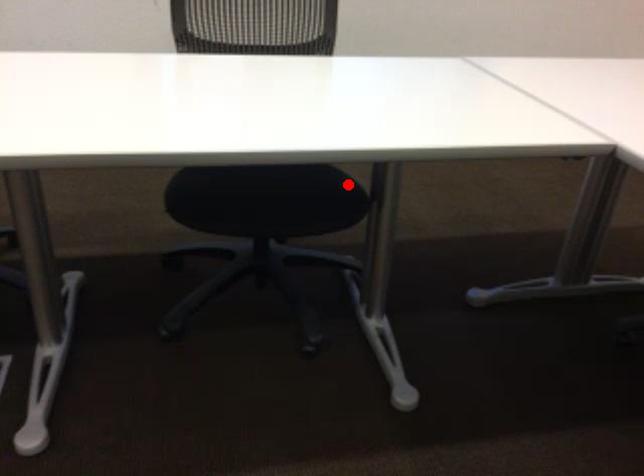
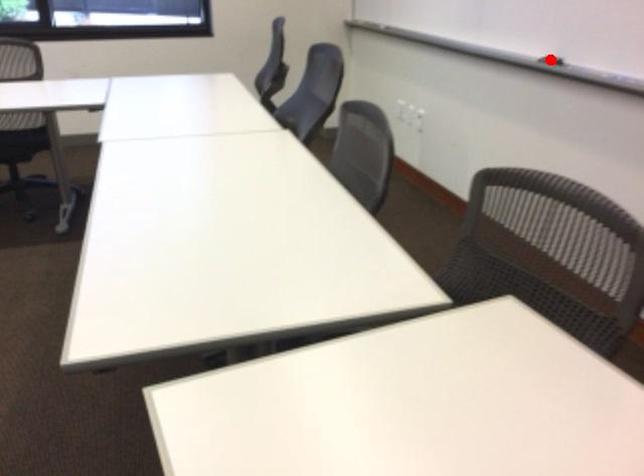
I am providing you with two images of the same scene from different viewpoints. A red point is marked on the first image and another point is marked on the second image. Are the points marked in image1 and image2 representing the same 3D position?

No